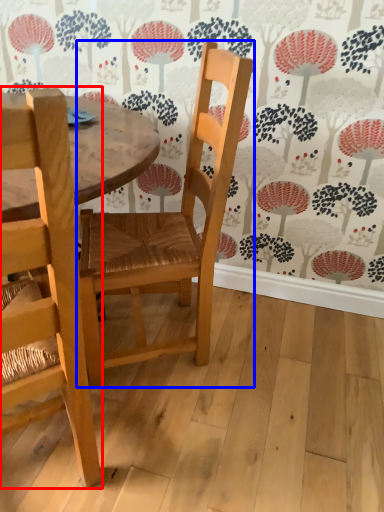
Question: Which object appears farthest to the camera in this image, chair (highlighted by a red box) or chair (highlighted by a blue box)?

Choices:
 (A) chair
 (B) chair

Answer: (B)